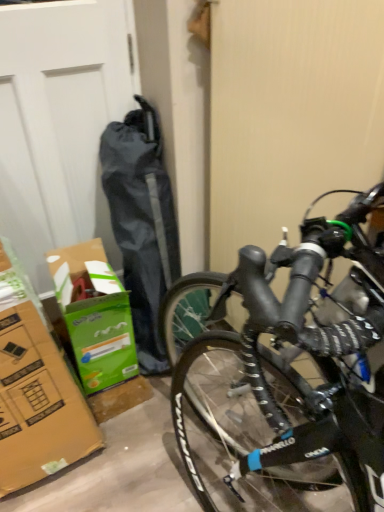
The width and height of the screenshot is (384, 512). I want to click on green cardboard box at lower left, so click(x=94, y=314).

Is green cardboard box at lower left completely or partially inside black matte bicycle at right?

No, black matte bicycle at right does not contain green cardboard box at lower left.

Does black matte bicycle at right have a greater width compared to green cardboard box at lower left?

Correct, the width of black matte bicycle at right exceeds that of green cardboard box at lower left.

Would you say black matte bicycle at right is to the left or to the right of green cardboard box at lower left in the picture?

From the image, it's evident that black matte bicycle at right is to the right of green cardboard box at lower left.

From the image's perspective, is black matte bicycle at right under green cardboard box at lower left?

No, from the image's perspective, black matte bicycle at right is not below green cardboard box at lower left.

Could you tell me if green cardboard box at lower left is turned towards white matte garage door at left?

No, green cardboard box at lower left is not oriented towards white matte garage door at left.

Considering the relative positions of green cardboard box at lower left and white matte garage door at left in the image provided, is green cardboard box at lower left to the right of white matte garage door at left from the viewer's perspective?

Indeed, green cardboard box at lower left is positioned on the right side of white matte garage door at left.

From a real-world perspective, does green cardboard box at lower left sit lower than white matte garage door at left?

Yes, from a real-world perspective, green cardboard box at lower left is beneath white matte garage door at left.

Where is `garage door on the left of green cardboard box at lower left`? garage door on the left of green cardboard box at lower left is located at coordinates (61, 122).

Considering their positions, is white matte garage door at left located in front of or behind green cardboard box at lower left?

Clearly, white matte garage door at left is in front of green cardboard box at lower left.

In terms of height, does white matte garage door at left look taller or shorter compared to green cardboard box at lower left?

In the image, white matte garage door at left appears to be taller than green cardboard box at lower left.

Is white matte garage door at left in contact with green cardboard box at lower left?

No, white matte garage door at left is not with green cardboard box at lower left.

Which of these two, white matte garage door at left or green cardboard box at lower left, is thinner?

Thinner between the two is white matte garage door at left.

Is green cardboard box at lower left to the left or to the right of black matte bicycle at right in the image?

From the image, it's evident that green cardboard box at lower left is to the left of black matte bicycle at right.

Is green cardboard box at lower left beside black matte bicycle at right?

green cardboard box at lower left is not next to black matte bicycle at right, and they're not touching.

Is green cardboard box at lower left spatially inside black matte bicycle at right, or outside of it?

green cardboard box at lower left is outside black matte bicycle at right.

Between green cardboard box at lower left and black matte bicycle at right, which one has smaller size?

With smaller size is green cardboard box at lower left.

Can you tell me how much black matte bicycle at right and white matte garage door at left differ in facing direction?

85.3 degrees.

Would you say black matte bicycle at right is outside white matte garage door at left?

Yes, black matte bicycle at right is outside of white matte garage door at left.

Consider the image. Between black matte bicycle at right and white matte garage door at left, which one has more height?

With more height is black matte bicycle at right.

Can you confirm if black matte bicycle at right is wider than white matte garage door at left?

Yes.

From the image's perspective, is white matte garage door at left positioned above or below black matte bicycle at right?

white matte garage door at left is above black matte bicycle at right.

Which is in front, point (27, 23) or point (236, 163)?

The point (27, 23) is in front.

Looking at this image, from a real-world perspective, is white matte garage door at left on black matte bicycle at right?

No, from a real-world perspective, white matte garage door at left is not above black matte bicycle at right.

Where is `cardboard box on the left of black matte bicycle at right`? cardboard box on the left of black matte bicycle at right is located at coordinates (94, 314).

The width and height of the screenshot is (384, 512). What are the coordinates of `cardboard box lying behind the white matte garage door at left` in the screenshot? It's located at (94, 314).

From the picture: Looking at the image, which one is located closer to green cardboard box at lower left, white matte garage door at left or black matte bicycle at right?

white matte garage door at left is closer to green cardboard box at lower left.

From the image, which object appears to be farther from green cardboard box at lower left, black matte bicycle at right or white matte garage door at left?

black matte bicycle at right lies further to green cardboard box at lower left than the other object.

When comparing their distances from black matte bicycle at right, does green cardboard box at lower left or white matte garage door at left seem closer?

Among the two, white matte garage door at left is located nearer to black matte bicycle at right.

From the image, which object appears to be farther from black matte bicycle at right, white matte garage door at left or green cardboard box at lower left?

Based on the image, green cardboard box at lower left appears to be further to black matte bicycle at right.

When comparing their distances from white matte garage door at left, does green cardboard box at lower left or black matte bicycle at right seem closer?

green cardboard box at lower left is positioned closer to the anchor white matte garage door at left.

Looking at the image, which one is located closer to white matte garage door at left, black matte bicycle at right or green cardboard box at lower left?

green cardboard box at lower left lies closer to white matte garage door at left than the other object.

Identify the location of cardboard box located between white matte garage door at left and black matte bicycle at right in the left-right direction. The image size is (384, 512). (94, 314).